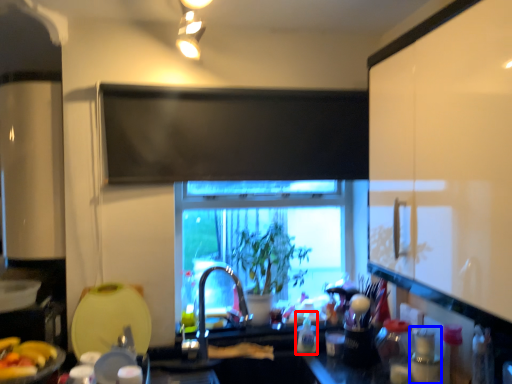
Question: Which object appears farthest to the camera in this image, bottle (highlighted by a red box) or bottle (highlighted by a blue box)?

Choices:
 (A) bottle
 (B) bottle

Answer: (A)